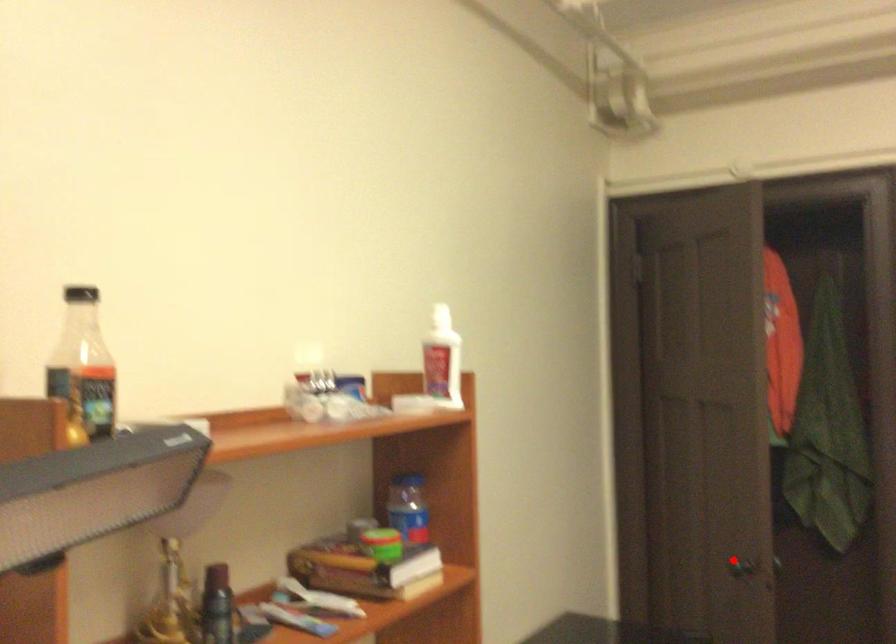
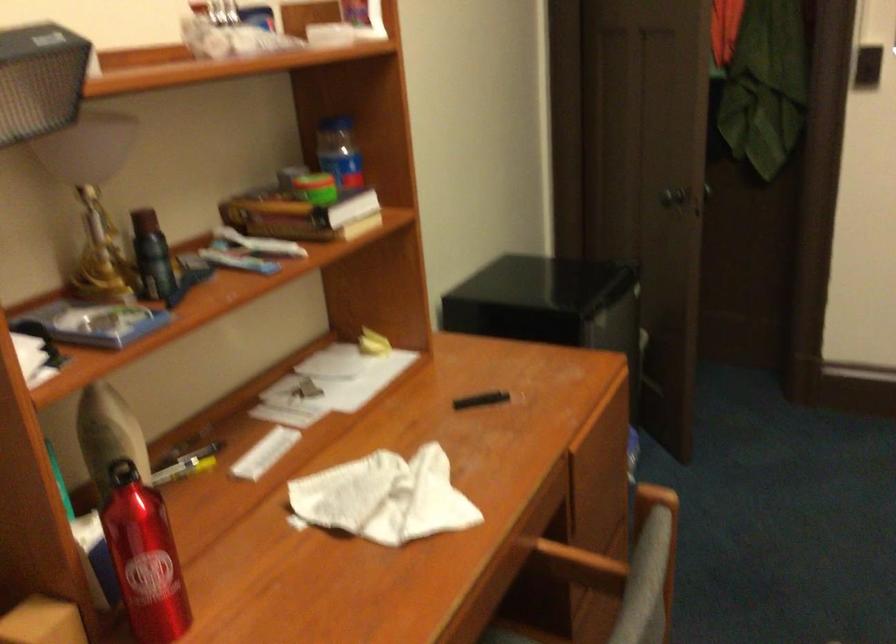
Question: I am providing you with two images of the same scene from different viewpoints. A red point is marked on the first image. At the location where the point appears in image 1, is it still visible in image 2?

Choices:
 (A) Yes
 (B) No

Answer: (A)